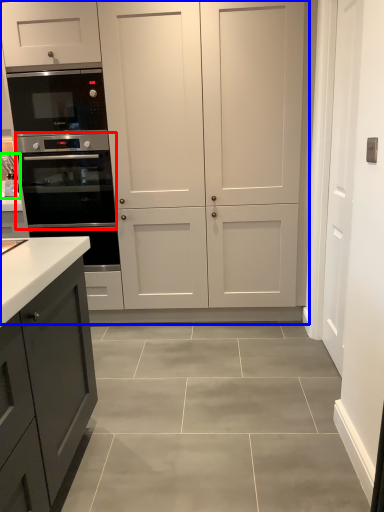
Question: Which object is the closest to the oven (highlighted by a red box)? Choose among these: cupboard (highlighted by a blue box) or sink (highlighted by a green box).

Choices:
 (A) cupboard
 (B) sink

Answer: (A)